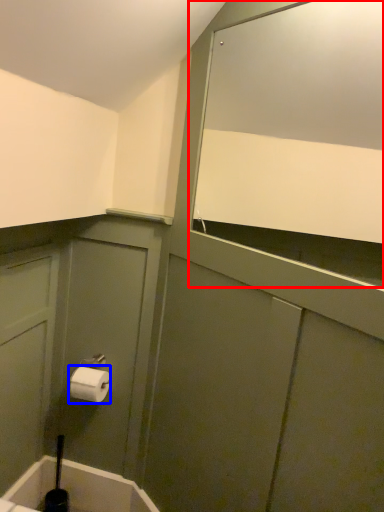
Question: Which point is closer to the camera, mirror (highlighted by a red box) or toilet paper (highlighted by a blue box)?

Choices:
 (A) mirror
 (B) toilet paper

Answer: (A)